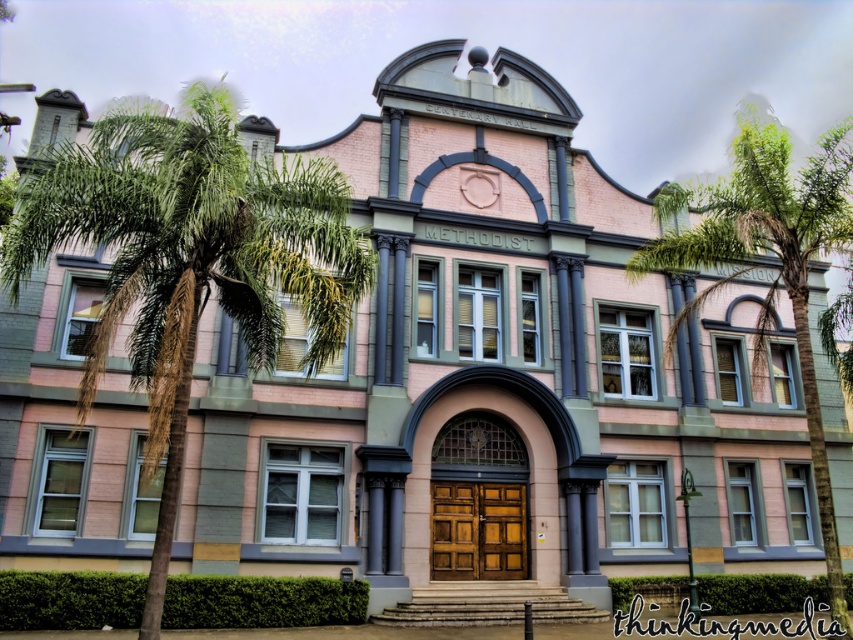
You are standing in front of the historic building and want to determine which of the two points, point (x=183, y=163) or point (x=776, y=186), is closer to you. Based on the building layout, which point is nearer?

Point (x=183, y=163) is closer to the viewer than point (x=776, y=186).